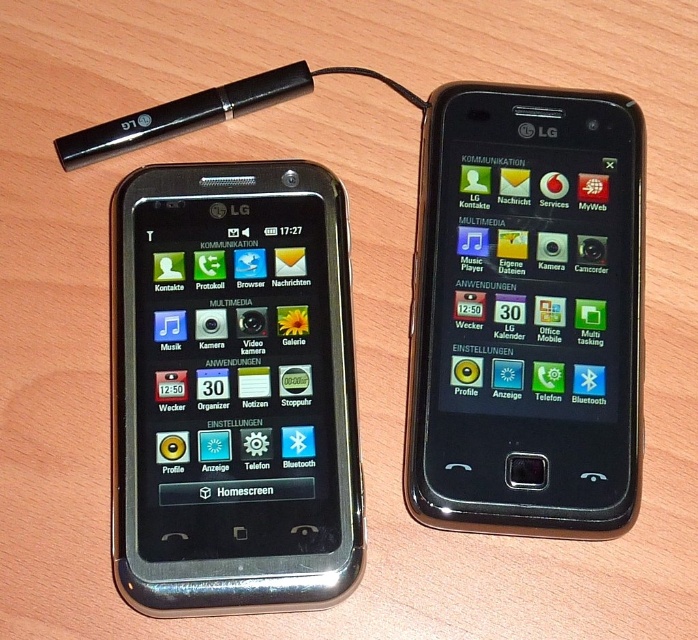
You are holding a black glossy smartphone at left and want to place it closer to the black glossy smartphone at center. Are you moving it forward or backward?

The black glossy smartphone at left is already closer to the viewer than the black glossy smartphone at center. To move it closer to the latter, you would need to move it backward.

Looking at this image, you are holding a phone and want to take a photo of the point at coordinates point (285,538). The camera is located at camera. Can you estimate whether you can capture the point in your photo without moving the phone?

The point point (285,538) and the camera are 4.11 feet apart. Since the distance between them is 4.11 feet, it is possible to capture the point in the photo as long as the camera is aimed correctly towards the point.